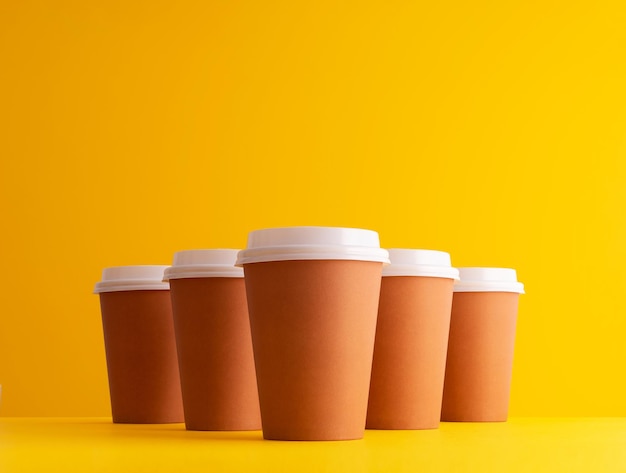
The height and width of the screenshot is (473, 626). I want to click on white lids of coffee cups, so tap(126, 275), tap(196, 264), tap(285, 247), tap(407, 251), tap(476, 283).